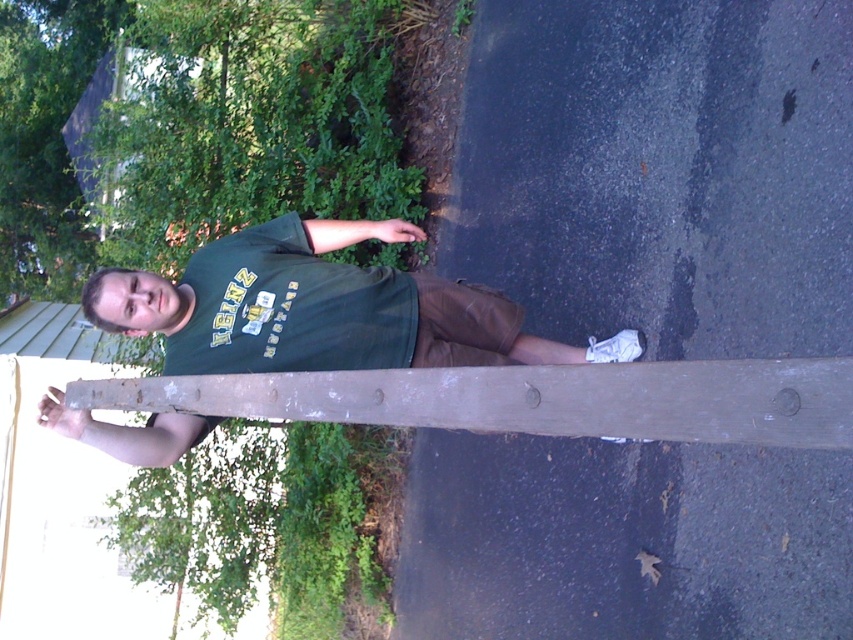
You are a photographer trying to capture a portrait of the person wearing the green matte shirt at center. The weathered wood plank at center is blocking part of the view. Which object should you move closer to the camera to ensure the person is fully visible?

You should move the weathered wood plank at center closer to the camera so that the green matte shirt at center becomes more visible. However, according to the description, the green matte shirt at center is already further to the viewer than the weathered wood plank at center, meaning the shirt is closer. Therefore, the wood plank is behind the person and not blocking the view. Thus, no adjustment is needed as the green matte shirt at center is already in front of the weathered wood plank at center.

You are a photographer setting up for a portrait. You notice the green matte shirt at center and the weathered wood plank at center in the frame. Based on their positions, which object is closer to the camera?

The green matte shirt at center is located above the weathered wood plank at center, so it is closer to the camera.

You are a photographer trying to capture the perfect shot of the green matte shirt at center. Based on its position coordinates, where should you aim your camera to ensure the shirt is centered in the frame?

The green matte shirt at center is already positioned at coordinates point (322, 308), which is very close to the center of the frame. Aim your camera slightly to the left and down to ensure the shirt is perfectly centered.